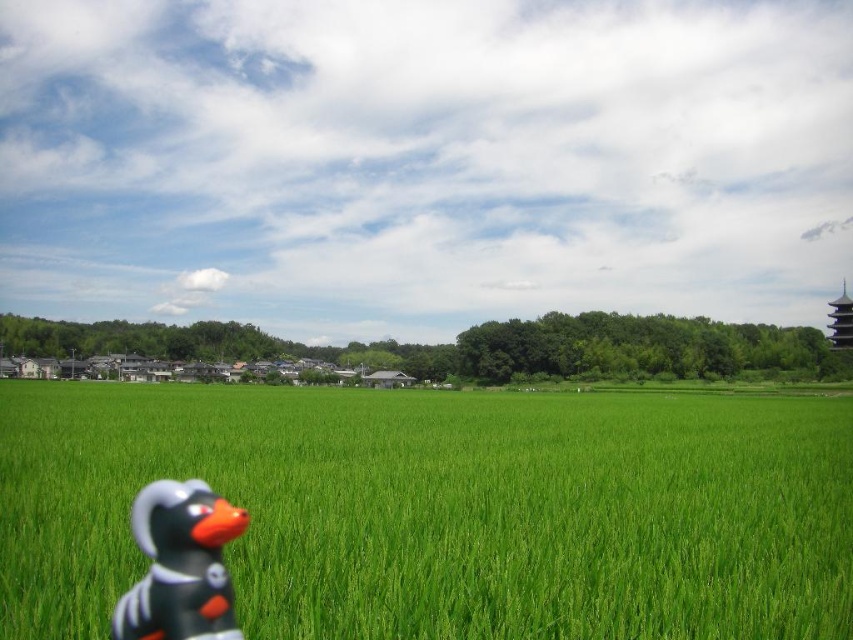
Question: Does green grassy field at lower center appear under rubber duck at lower left?

Choices:
 (A) yes
 (B) no

Answer: (A)

Question: Does green grassy field at lower center appear over rubber duck at lower left?

Choices:
 (A) no
 (B) yes

Answer: (A)

Question: Can you confirm if green grassy field at lower center is wider than rubber duck at lower left?

Choices:
 (A) no
 (B) yes

Answer: (B)